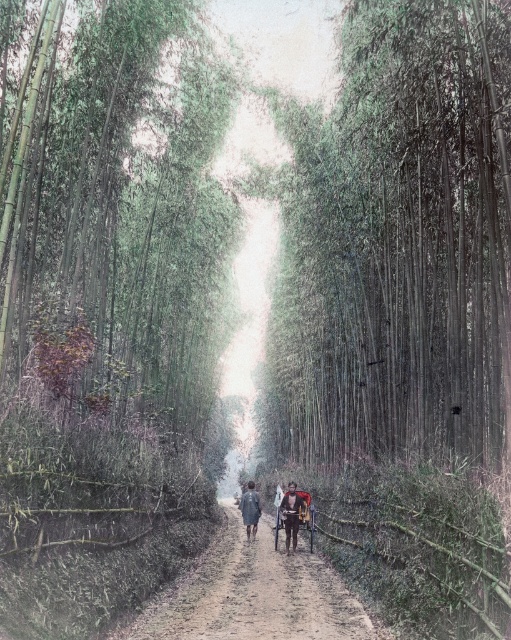
You are standing at the start of the narrow dirt path and see the wooden cart at center. If you want to reach the cart, should you walk towards the middle of the path or the side?

The wooden cart at center is located at point (x=294, y=516), which is in the center of the path, so you should walk towards the middle of the path to reach it.

You are a hiker carrying a backpack that is 1.5 meters wide. You are standing on the dusty brown dirt road at center and want to move to the wooden cart at center. Is there enough space for your backpack to fit through the gap between them?

The dusty brown dirt road at center and wooden cart at center are 2.62 meters apart. Since your backpack is 1.5 meters wide, there is sufficient space for it to fit through the gap between them.

You are standing on the narrow dirt path surrounded by tall bamboo trees. You see two points marked on the path. The first point is at coordinates point (310, 609) and the second point is at point (275, 541). If you are facing the direction the path leads, which point is closer to you?

Point (310, 609) is in front of point (275, 541), so the first point is closer to you.